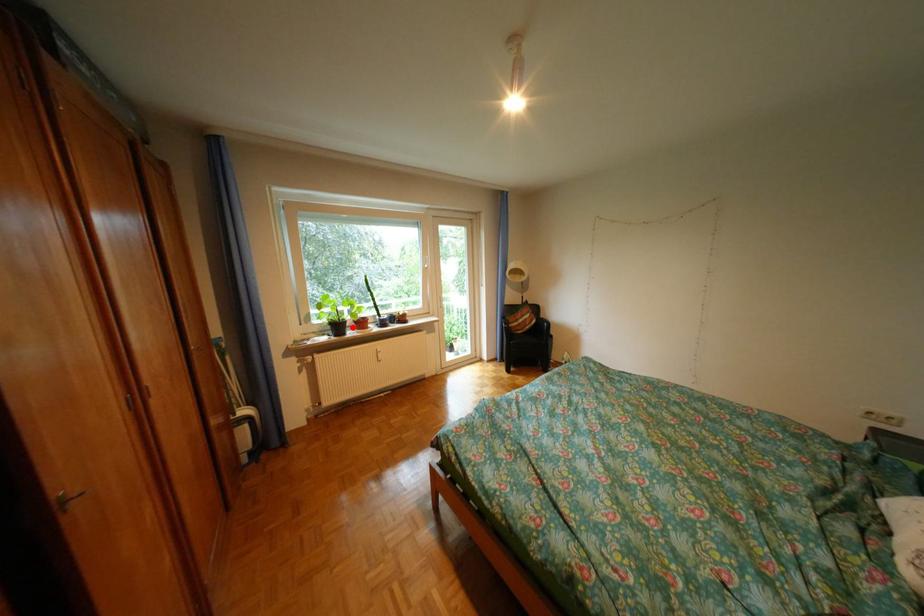
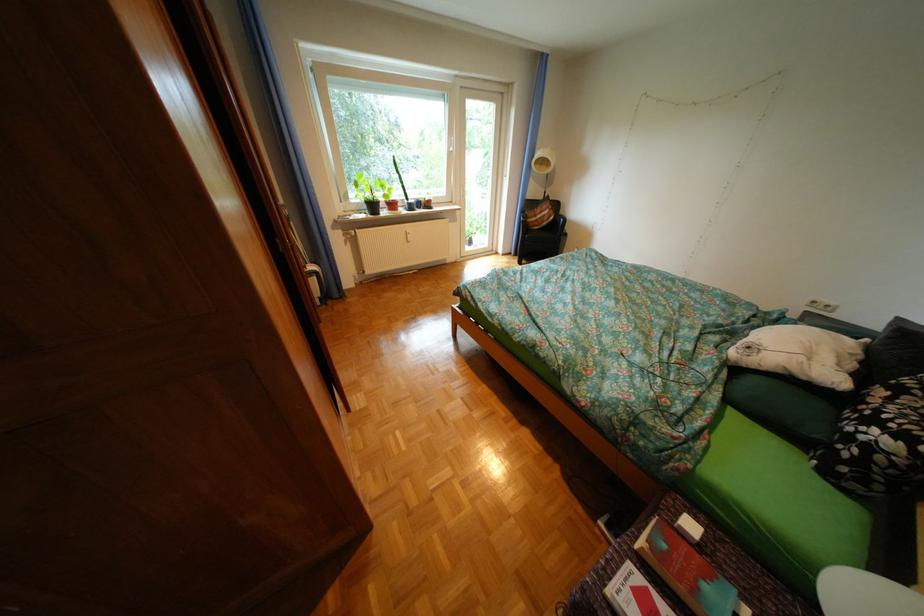
Question: I am providing you with two images of the same scene from different viewpoints. A red point is marked on the first image. At the location where the point appears in image 1, is it still visible in image 2?

Choices:
 (A) Yes
 (B) No

Answer: (A)